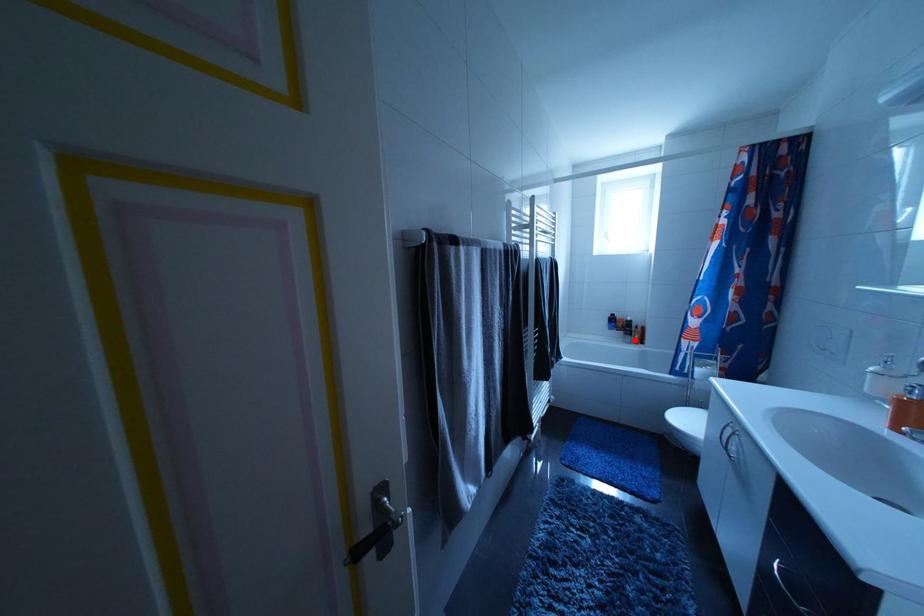
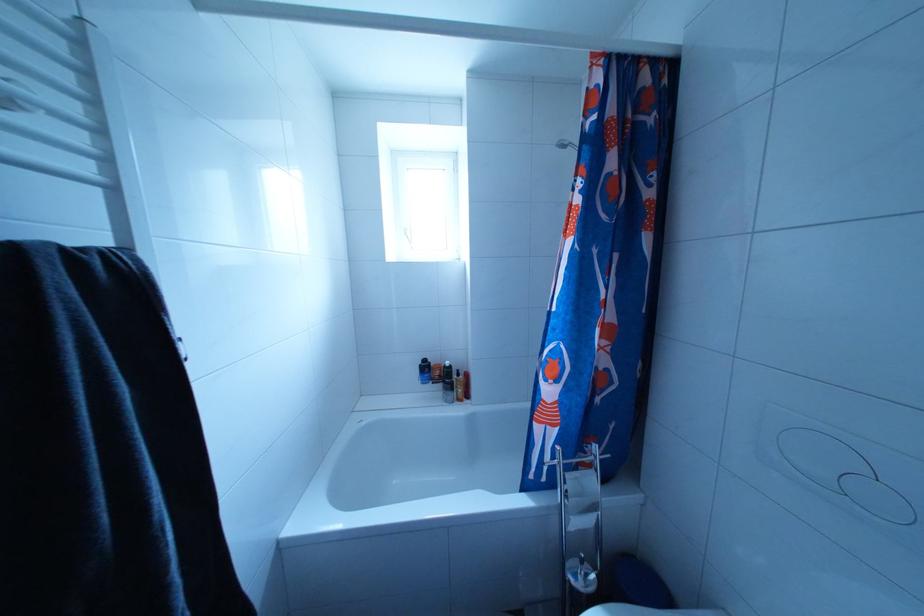
The point at the highlighted location is marked in the first image. Where is the corresponding point in the second image?

(455, 395)